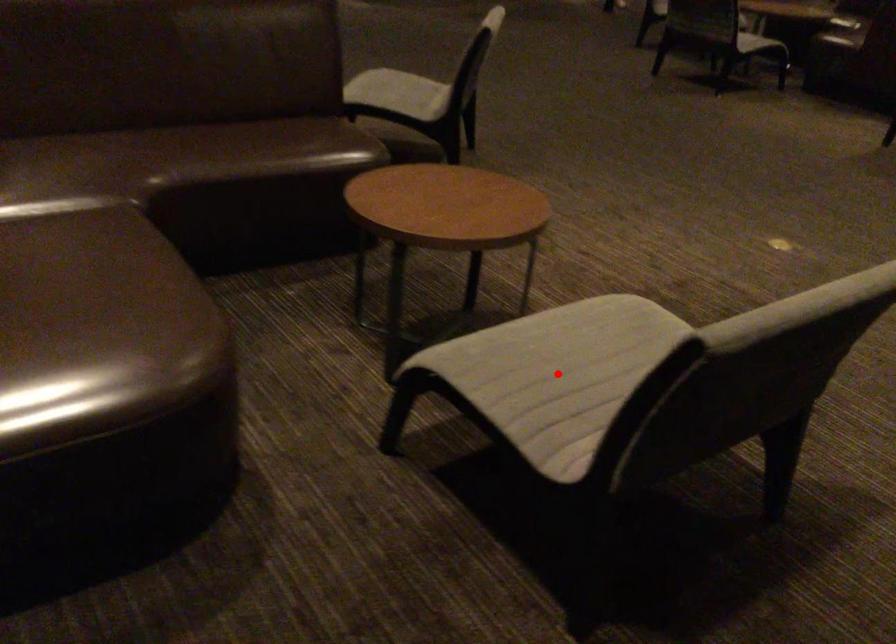
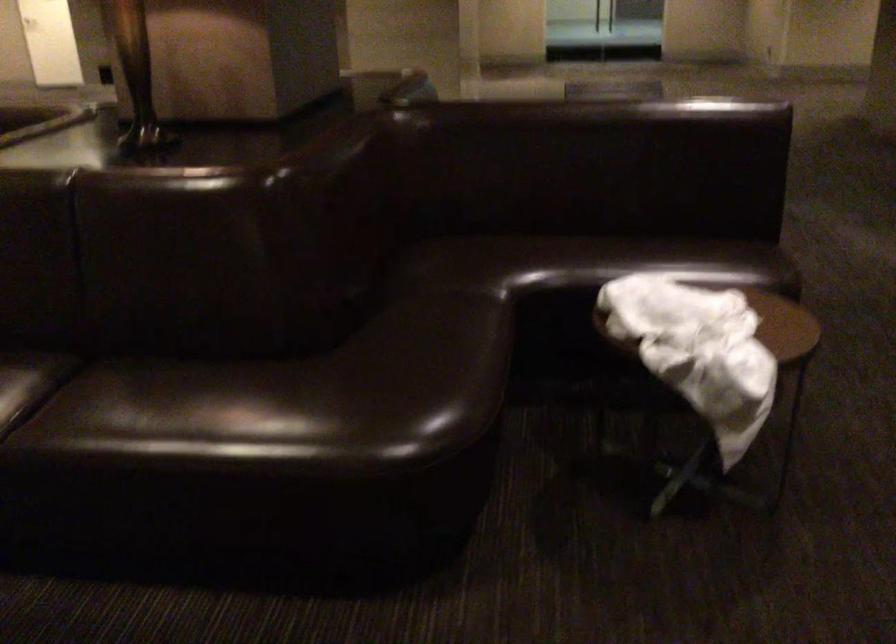
Question: I am providing you with two images of the same scene from different viewpoints. A red point is marked on the first image. At the location where the point appears in image 1, is it still visible in image 2?

Choices:
 (A) Yes
 (B) No

Answer: (B)